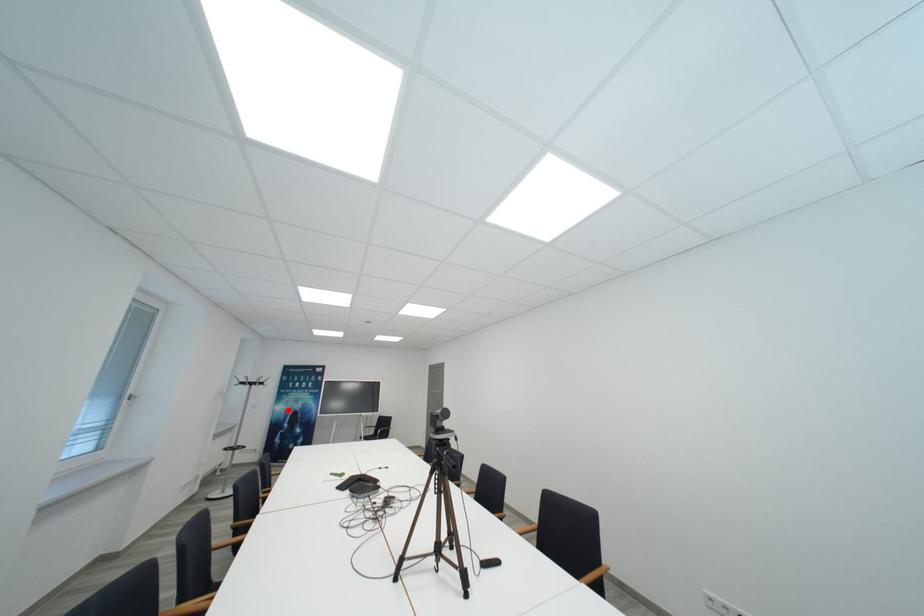
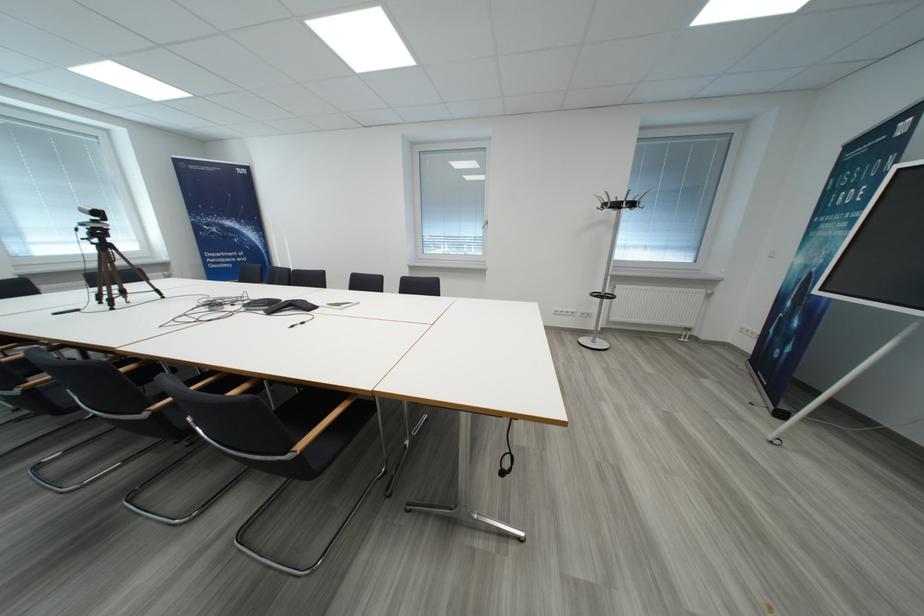
Question: A red point is marked in image1. In image2, is the corresponding 3D point closer to the camera or farther? Reply with the corresponding letter.

Choices:
 (A) The corresponding 3D point is closer.
 (B) The corresponding 3D point is farther.

Answer: (A)